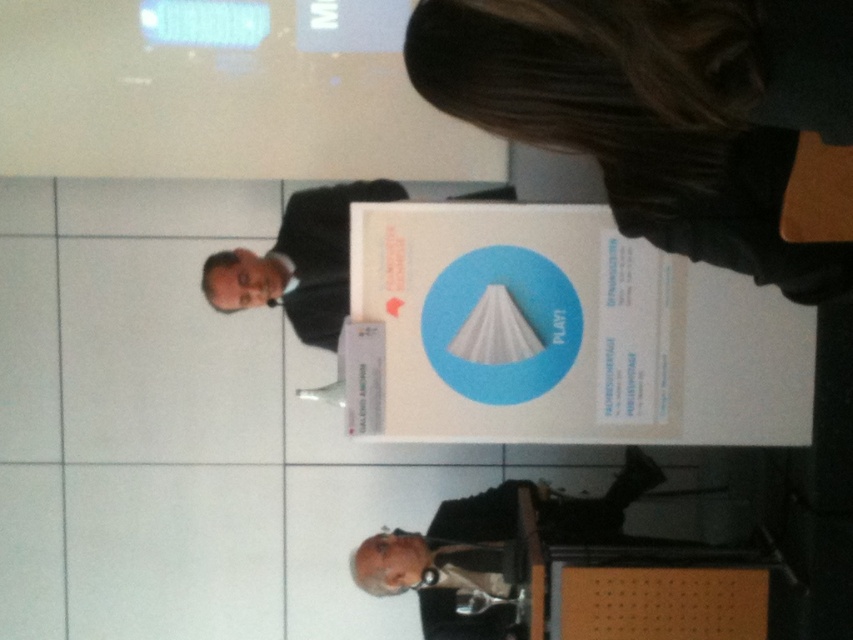
I want to click on black fabric hair at upper center, so click(672, 116).

Is point (676, 3) more distant than point (328, 241)?

No.

The width and height of the screenshot is (853, 640). In order to click on black fabric hair at upper center in this screenshot , I will do `click(672, 116)`.